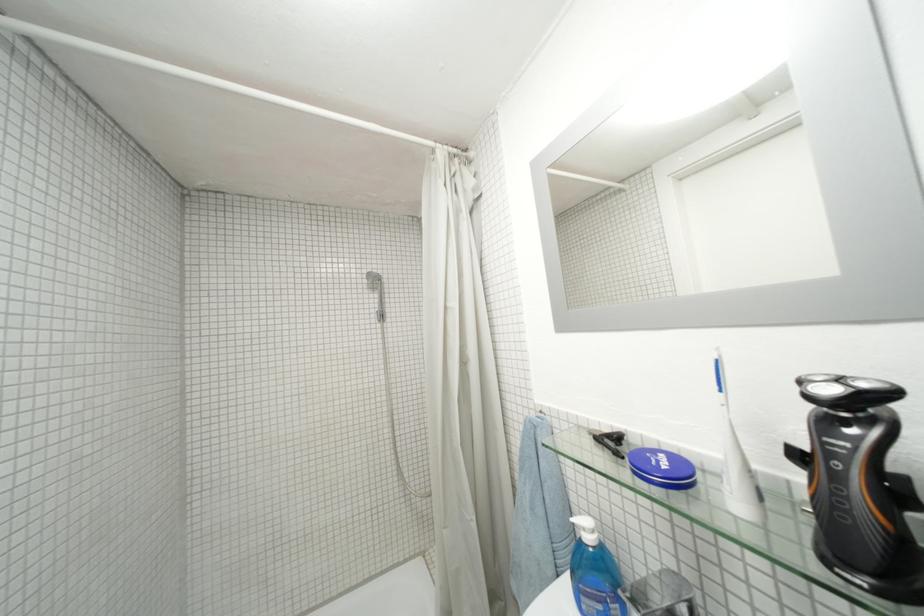
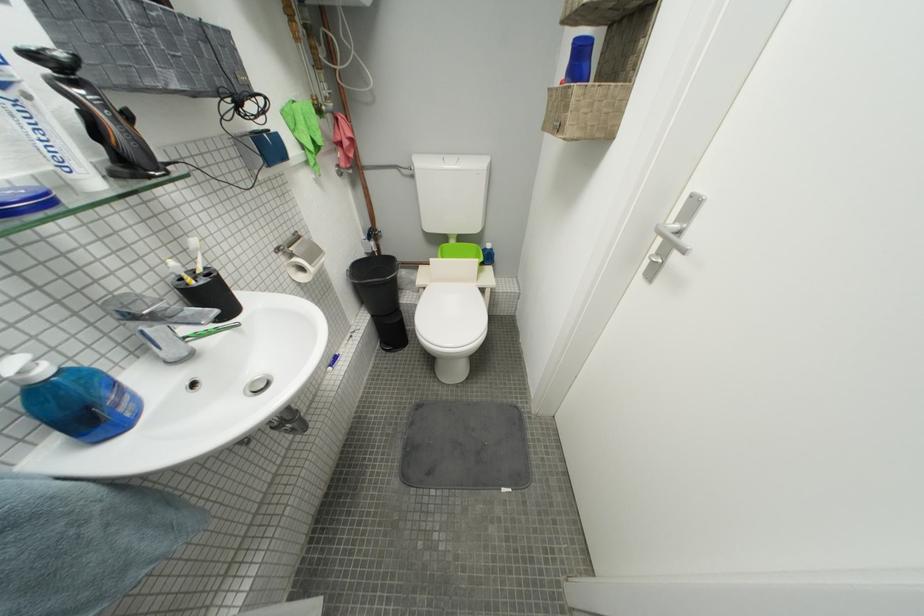
The point at (598, 541) is marked in the first image. Where is the corresponding point in the second image?

(53, 374)